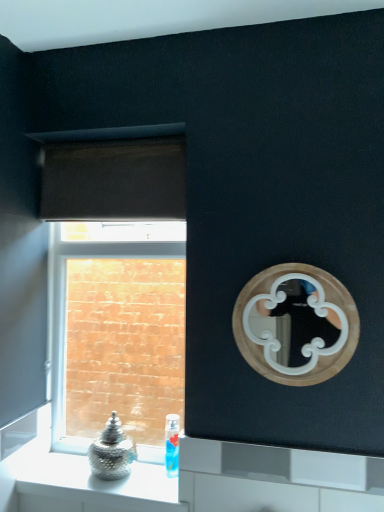
What is the approximate height of metallic glass jar at lower left?

It is 5.10 centimeters.

Describe the element at coordinates (117, 288) in the screenshot. The height and width of the screenshot is (512, 384). I see `brick textured wall at left` at that location.

Locate an element on the screen. brown fabric curtain at upper left is located at coordinates (114, 179).

At what (x,y) coordinates should I click in order to perform the action: click on metallic glass jar at lower left. Please return your answer as a coordinate pair (x, y). The width and height of the screenshot is (384, 512). Looking at the image, I should click on pos(83,486).

Is brown fabric curtain at upper left looking in the opposite direction of metallic glass jar at lower left?

No, brown fabric curtain at upper left's orientation is not away from metallic glass jar at lower left.

Where is `curtain above the metallic glass jar at lower left (from the image's perspective)`? This screenshot has height=512, width=384. curtain above the metallic glass jar at lower left (from the image's perspective) is located at coordinates (114, 179).

Is point (52, 208) farther from viewer compared to point (38, 459)?

That is True.

From a real-world perspective, which is physically above, brown fabric curtain at upper left or metallic glass jar at lower left?

brown fabric curtain at upper left, from a real-world perspective.

Considering their positions, is translucent plastic bottle at lower center located in front of or behind brown fabric curtain at upper left?

In the image, translucent plastic bottle at lower center appears behind brown fabric curtain at upper left.

From the picture: Is translucent plastic bottle at lower center spatially inside brown fabric curtain at upper left, or outside of it?

translucent plastic bottle at lower center exists outside the volume of brown fabric curtain at upper left.

The height and width of the screenshot is (512, 384). Find the location of `toiletry below the brown fabric curtain at upper left (from a real-world perspective)`. toiletry below the brown fabric curtain at upper left (from a real-world perspective) is located at coordinates (172, 445).

Is brown fabric curtain at upper left at the back of translucent plastic bottle at lower center?

No.

At what (x,y) coordinates should I click in order to perform the action: click on curtain that is on the left side of wooden mirror at upper right. Please return your answer as a coordinate pair (x, y). The image size is (384, 512). Looking at the image, I should click on (114, 179).

Which object is closer to the camera taking this photo, wooden mirror at upper right or brown fabric curtain at upper left?

Positioned in front is wooden mirror at upper right.

Does point (295, 368) appear closer or farther from the camera than point (131, 212)?

Point (295, 368).

Which is more to the right, wooden mirror at upper right or brown fabric curtain at upper left?

wooden mirror at upper right is more to the right.

Considering the sizes of objects translucent plastic bottle at lower center and brick textured wall at left in the image provided, who is bigger, translucent plastic bottle at lower center or brick textured wall at left?

brick textured wall at left is bigger.

Which object is thinner, translucent plastic bottle at lower center or brick textured wall at left?

brick textured wall at left is thinner.

Considering the relative sizes of translucent plastic bottle at lower center and brick textured wall at left in the image provided, is translucent plastic bottle at lower center taller than brick textured wall at left?

No, translucent plastic bottle at lower center is not taller than brick textured wall at left.

Locate an element on the screen. toiletry on the right of brick textured wall at left is located at coordinates (172, 445).

You are a GUI agent. You are given a task and a screenshot of the screen. Output one action in this format:
    pyautogui.click(x=<x>, y=<y>)
    Task: Click on the mirror on the right of translucent plastic bottle at lower center
    
    Given the screenshot: What is the action you would take?
    pyautogui.click(x=305, y=344)

Does point (319, 346) appear closer or farther from the camera than point (166, 426)?

Point (319, 346).

Considering the positions of objects wooden mirror at upper right and translucent plastic bottle at lower center in the image provided, who is behind, wooden mirror at upper right or translucent plastic bottle at lower center?

translucent plastic bottle at lower center is further from the camera.

Is wooden mirror at upper right oriented towards translucent plastic bottle at lower center?

No, wooden mirror at upper right is not turned towards translucent plastic bottle at lower center.

Which object is positioned more to the left, metallic glass jar at lower left or brown fabric curtain at upper left?

brown fabric curtain at upper left.

From the image's perspective, would you say metallic glass jar at lower left is shown under brown fabric curtain at upper left?

Indeed, from the image's perspective, metallic glass jar at lower left is shown beneath brown fabric curtain at upper left.

This screenshot has height=512, width=384. I want to click on counter in front of the brown fabric curtain at upper left, so click(83, 486).

Can you confirm if metallic glass jar at lower left is bigger than brown fabric curtain at upper left?

Yes, metallic glass jar at lower left is bigger than brown fabric curtain at upper left.

Is metallic glass jar at lower left positioned beyond the bounds of brick textured wall at left?

That's correct, metallic glass jar at lower left is outside of brick textured wall at left.

Between metallic glass jar at lower left and brick textured wall at left, which one has smaller width?

brick textured wall at left.

Looking at this image, from a real-world perspective, which is physically above, metallic glass jar at lower left or brick textured wall at left?

brick textured wall at left.

Where is `curtain lying above the metallic glass jar at lower left (from the image's perspective)`? curtain lying above the metallic glass jar at lower left (from the image's perspective) is located at coordinates (114, 179).

Where is `curtain above the translucent plastic bottle at lower center (from a real-world perspective)`? The width and height of the screenshot is (384, 512). curtain above the translucent plastic bottle at lower center (from a real-world perspective) is located at coordinates (114, 179).

Which object lies nearer to the anchor point wooden mirror at upper right, brown fabric curtain at upper left or brick textured wall at left?

The object closer to wooden mirror at upper right is brown fabric curtain at upper left.

From the picture: Considering their positions, is brick textured wall at left positioned further to translucent plastic bottle at lower center than wooden mirror at upper right?

The object further to translucent plastic bottle at lower center is brick textured wall at left.

From the image, which object appears to be farther from metallic glass jar at lower left, wooden mirror at upper right or brown fabric curtain at upper left?

Based on the image, brown fabric curtain at upper left appears to be further to metallic glass jar at lower left.

Estimate the real-world distances between objects in this image. Which object is closer to wooden mirror at upper right, brown fabric curtain at upper left or metallic glass jar at lower left?

brown fabric curtain at upper left is closer to wooden mirror at upper right.

From the image, which object appears to be farther from translucent plastic bottle at lower center, brown fabric curtain at upper left or wooden mirror at upper right?

brown fabric curtain at upper left lies further to translucent plastic bottle at lower center than the other object.

From the image, which object appears to be farther from brick textured wall at left, metallic glass jar at lower left or wooden mirror at upper right?

wooden mirror at upper right.

Estimate the real-world distances between objects in this image. Which object is closer to metallic glass jar at lower left, wooden mirror at upper right or brick textured wall at left?

wooden mirror at upper right is closer to metallic glass jar at lower left.

When comparing their distances from translucent plastic bottle at lower center, does brick textured wall at left or brown fabric curtain at upper left seem closer?

Among the two, brown fabric curtain at upper left is located nearer to translucent plastic bottle at lower center.

Find the location of a particular element. Image resolution: width=384 pixels, height=512 pixels. window between brown fabric curtain at upper left and wooden mirror at upper right in the horizontal direction is located at coordinates (117, 288).

Identify the location of toiletry between brick textured wall at left and wooden mirror at upper right in the horizontal direction. The height and width of the screenshot is (512, 384). (172, 445).

Image resolution: width=384 pixels, height=512 pixels. In order to click on toiletry that lies between brown fabric curtain at upper left and metallic glass jar at lower left from top to bottom in this screenshot , I will do 172,445.

Where is `toiletry between brick textured wall at left and metallic glass jar at lower left from top to bottom`? Image resolution: width=384 pixels, height=512 pixels. toiletry between brick textured wall at left and metallic glass jar at lower left from top to bottom is located at coordinates (172, 445).